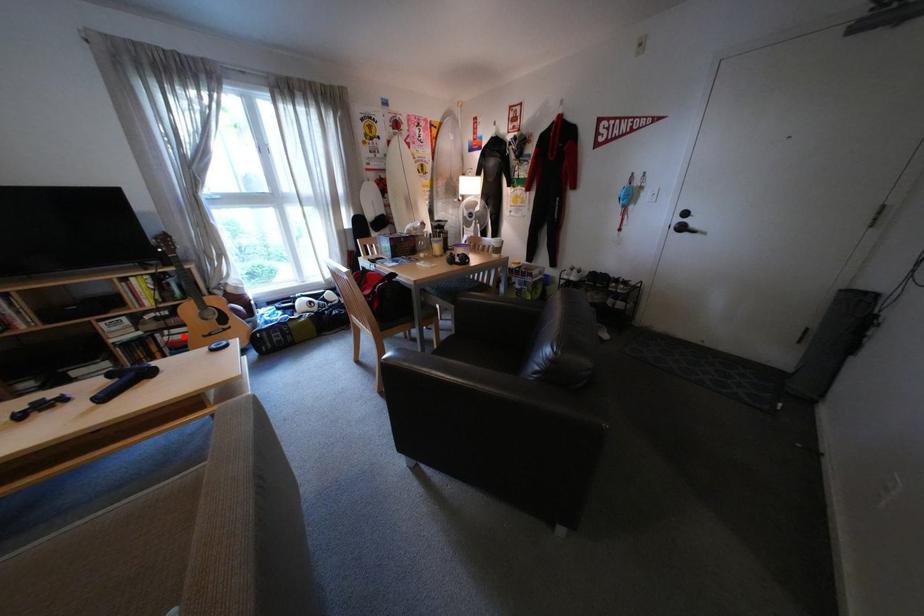
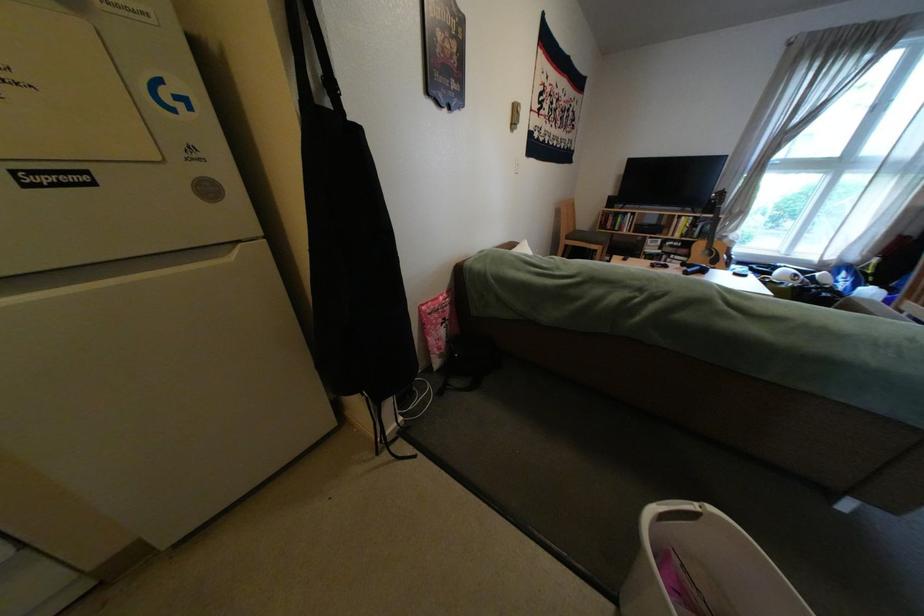
In the second image, find the point that corresponds to the highlighted location in the first image.

(687, 260)